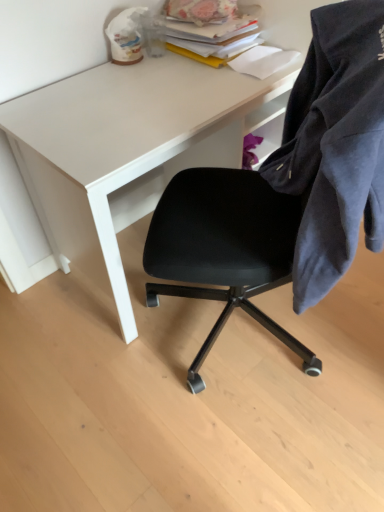
Question: Is point (289, 155) closer or farther from the camera than point (165, 28)?

Choices:
 (A) closer
 (B) farther

Answer: (A)

Question: From the image's perspective, relative to stacked paper at upper right, is dark blue cotton jacket at right above or below?

Choices:
 (A) below
 (B) above

Answer: (A)

Question: Which object is the farthest from the white matte desk at upper center?

Choices:
 (A) dark blue cotton jacket at right
 (B) stacked paper at upper right

Answer: (A)

Question: Estimate the real-world distances between objects in this image. Which object is closer to the white matte desk at upper center?

Choices:
 (A) dark blue cotton jacket at right
 (B) stacked paper at upper right

Answer: (B)